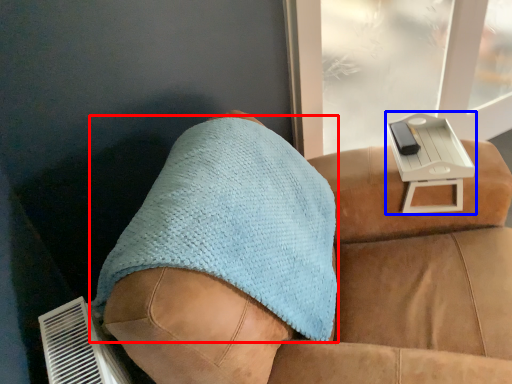
Question: Which point is further to the camera, throw pillow (highlighted by a red box) or table (highlighted by a blue box)?

Choices:
 (A) throw pillow
 (B) table

Answer: (B)